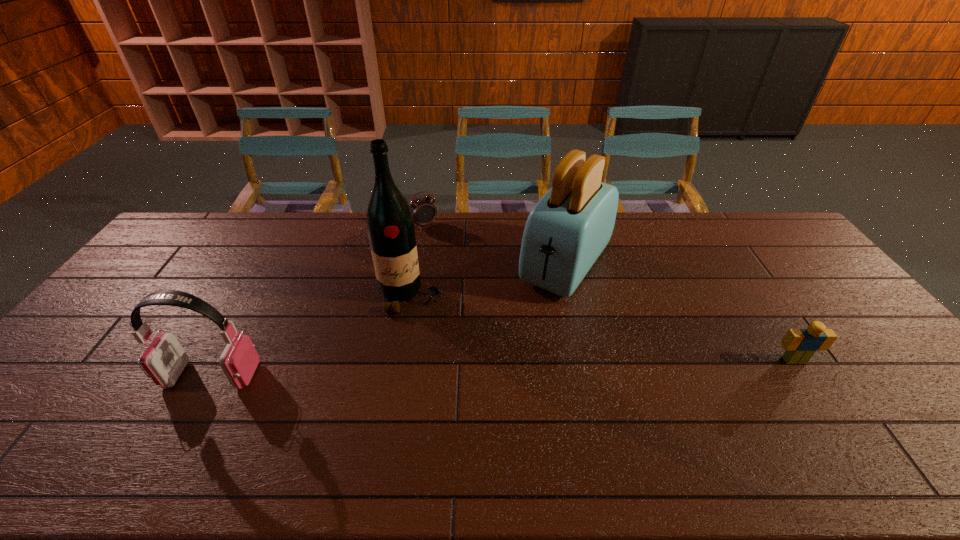
Where is `vacant region located on the face of the rightmost object`? vacant region located on the face of the rightmost object is located at coordinates (808, 381).

You are a GUI agent. You are given a task and a screenshot of the screen. Output one action in this format:
    pyautogui.click(x=<x>, y=<y>)
    Task: Click on the free location located on the side of the toaster with the lever
    This screenshot has width=960, height=540.
    Given the screenshot: What is the action you would take?
    pyautogui.click(x=512, y=341)

Identify the location of free space located 0.280m on the side of the toaster with the lever. (497, 361).

Where is `vacant space located 0.120m on the side of the toaster with the lever`? The width and height of the screenshot is (960, 540). vacant space located 0.120m on the side of the toaster with the lever is located at coordinates (525, 323).

At what (x,y) coordinates should I click in order to perform the action: click on vacant space located on the face of the alarm clock. Please return your answer as a coordinate pair (x, y). This screenshot has width=960, height=540. Looking at the image, I should click on (476, 295).

What are the coordinates of `vacant space located 0.160m on the face of the alarm clock` in the screenshot? It's located at (446, 254).

Where is `vacant region located on the face of the alarm clock`? vacant region located on the face of the alarm clock is located at coordinates (460, 273).

At what (x,y) coordinates should I click in order to perform the action: click on free region located 0.400m on the surface of the wine bottle. Please return your answer as a coordinate pair (x, y). Looking at the image, I should click on (487, 422).

I want to click on free region located on the surface of the wine bottle, so click(x=459, y=376).

Locate an element on the screen. The image size is (960, 540). free spot located 0.150m on the surface of the wine bottle is located at coordinates (443, 349).